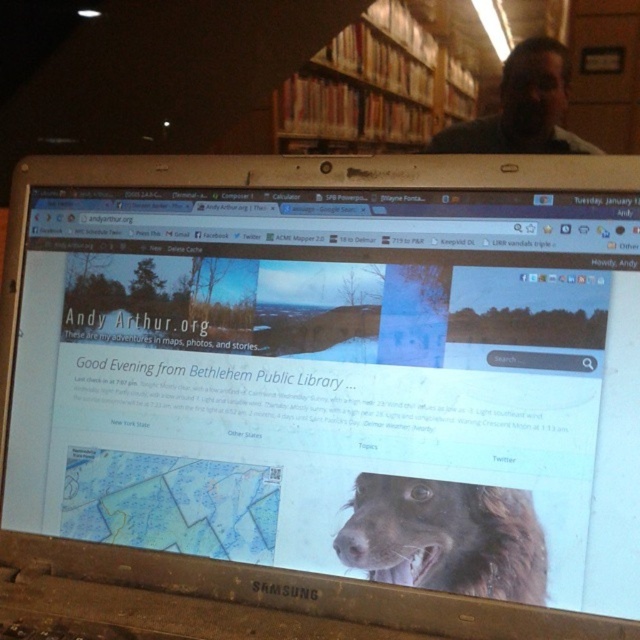
Question: Which point is closer to the camera?

Choices:
 (A) wooden bookshelf at upper center
 (B) matte black laptop at upper center
 (C) brown furry dog at center

Answer: (C)

Question: Can you confirm if brown furry dog at center is positioned below matte black laptop at upper center?

Choices:
 (A) no
 (B) yes

Answer: (B)

Question: Which point is closer to the camera?

Choices:
 (A) (445, 518)
 (B) (525, 100)
 (C) (292, 145)

Answer: (A)

Question: Considering the real-world distances, which object is closest to the wooden bookshelf at upper center?

Choices:
 (A) matte black laptop at upper center
 (B) brown furry dog at center

Answer: (A)

Question: Can you confirm if brown furry dog at center is bigger than matte black laptop at upper center?

Choices:
 (A) yes
 (B) no

Answer: (B)

Question: In this image, where is wooden bookshelf at upper center located relative to brown furry dog at center?

Choices:
 (A) above
 (B) below

Answer: (A)